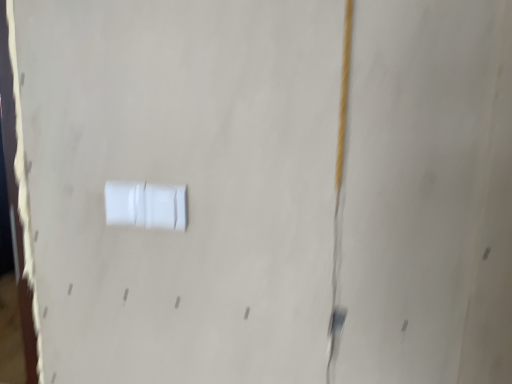
Question: Should I look upward or downward to see white plastic switch at center?

Choices:
 (A) up
 (B) down

Answer: (B)